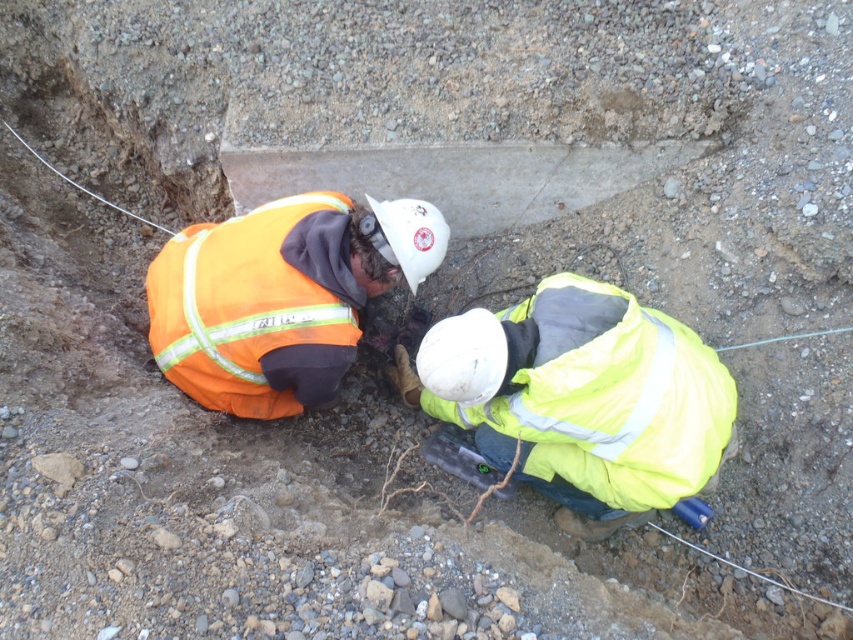
Can you confirm if yellow reflective jacket at center is bigger than orange reflective safety vest at lower left?

Correct, yellow reflective jacket at center is larger in size than orange reflective safety vest at lower left.

Does yellow reflective jacket at center appear over orange reflective safety vest at lower left?

No.

Which is behind, point (451, 422) or point (233, 394)?

The point (451, 422) is behind.

At what (x,y) coordinates should I click in order to perform the action: click on yellow reflective jacket at center. Please return your answer as a coordinate pair (x, y). The width and height of the screenshot is (853, 640). Looking at the image, I should click on (581, 396).